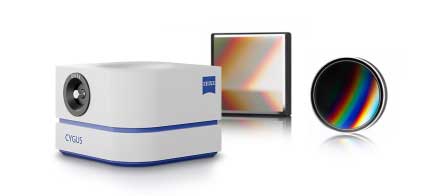
Locate an element on the screen. mirror is located at coordinates (346, 108).